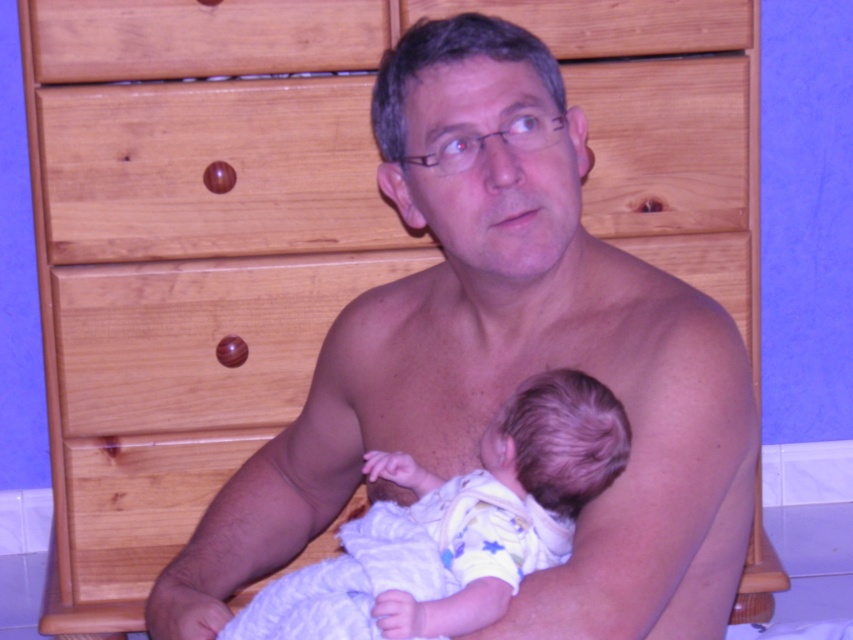
Between point (717, 339) and point (431, 604), which one is positioned behind?

The point (717, 339) is behind.

The image size is (853, 640). I want to click on smooth skin man at center, so click(x=503, y=364).

Identify the location of smooth skin man at center. This screenshot has width=853, height=640. (503, 364).